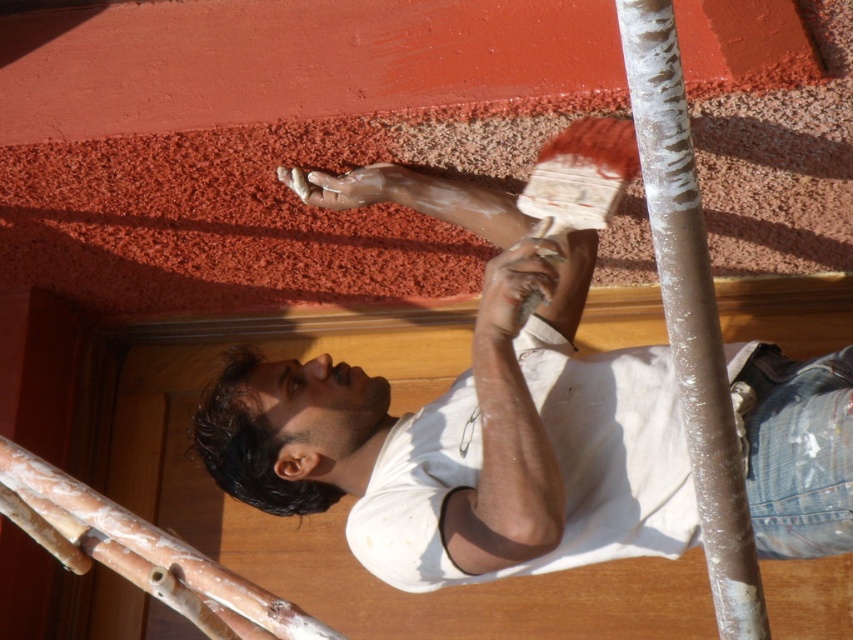
You are a painter standing 2 meters away from the wall you are painting. You notice your white matte shirt at center is getting paint splatters. If you want to move closer to the wall to avoid getting more paint on your shirt, how much closer should you move?

The white matte shirt at center is currently 2.22 meters away from the camera. Since you are already 2 meters away, you need to move 0.22 meters closer to reduce the distance to 2 meters and minimize paint splatters.

You are a painter standing in front of the wall. You have two points marked on the wall, one at point (666, 156) and the other at point (560, 196). Which point is closer to you?

Point (666, 156) is closer to the camera than point (560, 196), so the point at (666, 156) is closer to you.

You are a painter who just finished painting the wall. You notice your white matte shirt at center and white textured paintbrush at upper center. Which item is located lower in the image?

The white matte shirt at center is positioned under the white textured paintbrush at upper center, so the white matte shirt at center is lower in the image.